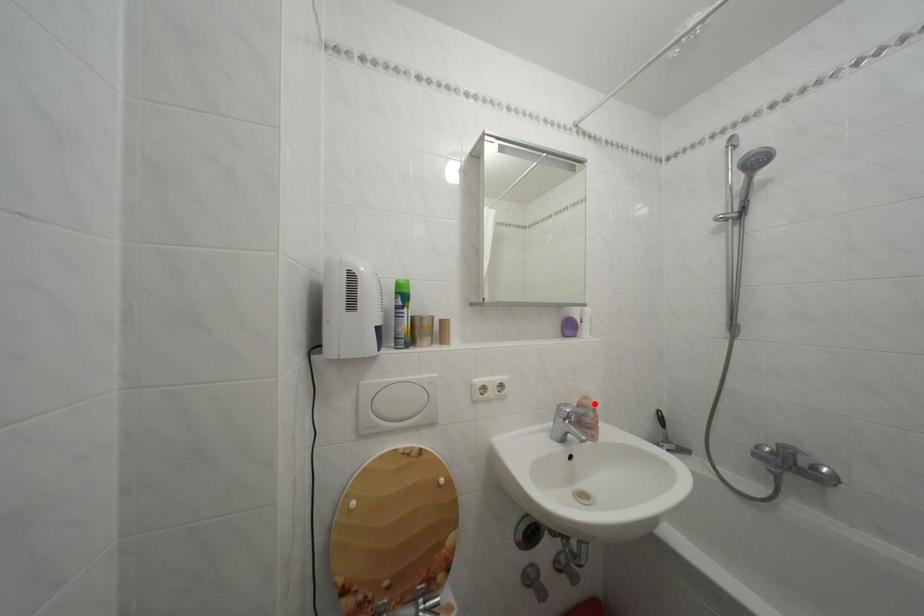
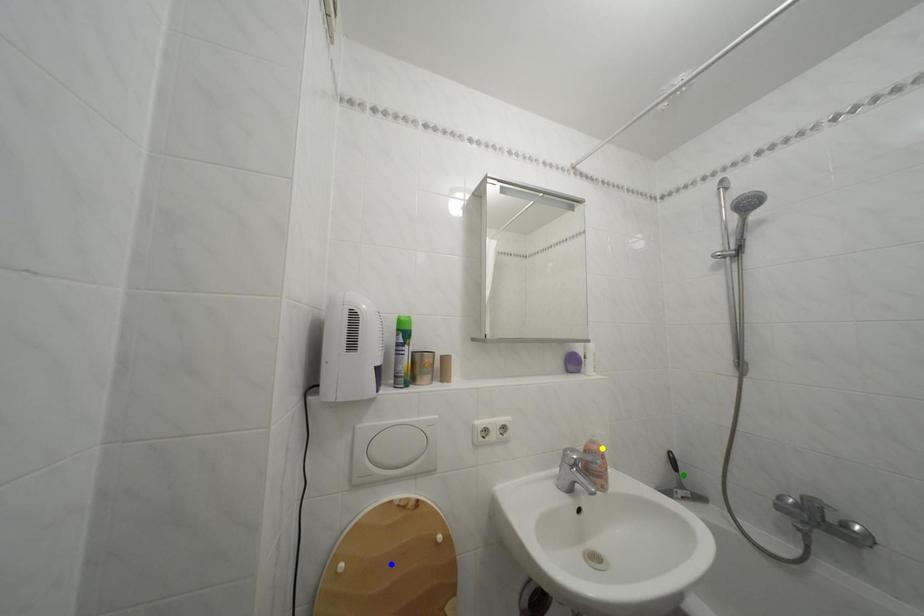
Question: I am providing you with two images of the same scene from different viewpoints. A red point is marked on the first image. You are given multiple points on the second image. Which point in image 2 is actually the same real-world point as the red point in image 1?

Choices:
 (A) green point
 (B) yellow point
 (C) blue point

Answer: (B)